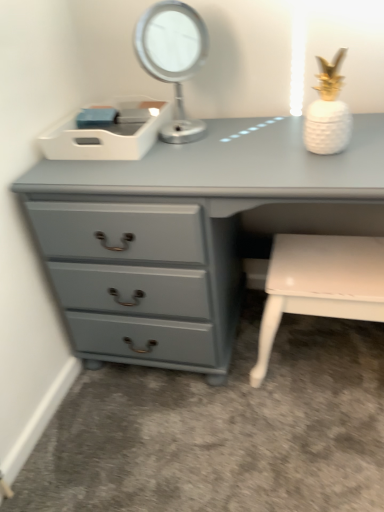
You are a GUI agent. You are given a task and a screenshot of the screen. Output one action in this format:
    pyautogui.click(x=<x>, y=<y>)
    Task: Click on the free location to the right of metallic silver table lamp at upper center
    The height and width of the screenshot is (512, 384).
    Given the screenshot: What is the action you would take?
    pyautogui.click(x=248, y=131)